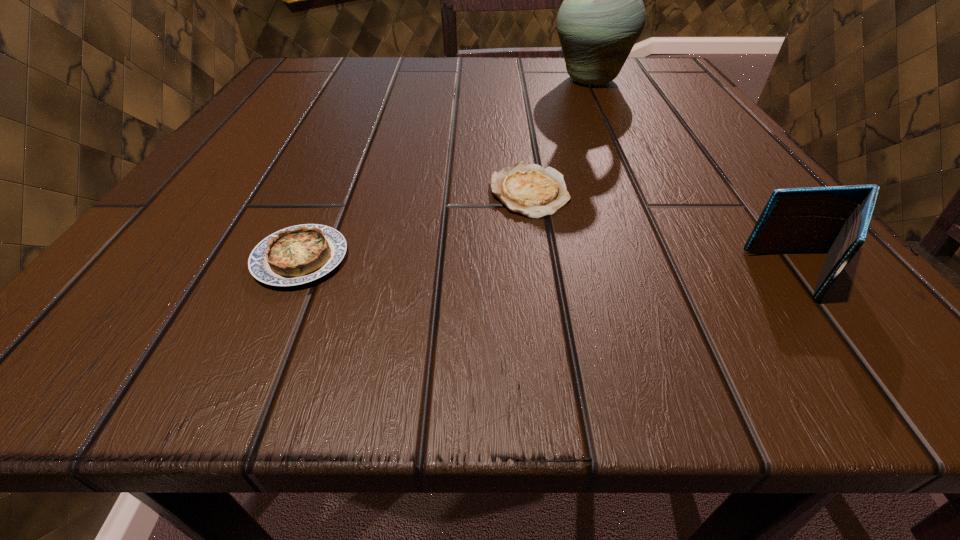
Choose which object is the third nearest neighbor to the farther quiche. Please provide its 2D coordinates. Your answer should be formatted as a tuple, i.e. [(x, y)], where the tuple contains the x and y coordinates of a point satisfying the conditions above.

[(602, 16)]

You are a GUI agent. You are given a task and a screenshot of the screen. Output one action in this format:
    pyautogui.click(x=<x>, y=<y>)
    Task: Click on the object that is the closest to the farthest object
    Image resolution: width=960 pixels, height=540 pixels.
    Given the screenshot: What is the action you would take?
    pyautogui.click(x=528, y=189)

The width and height of the screenshot is (960, 540). Find the location of `free spot that satisfies the following two spatial constraints: 1. on the handle side of the third object from left to right; 2. on the front side of the nearer quiche`. free spot that satisfies the following two spatial constraints: 1. on the handle side of the third object from left to right; 2. on the front side of the nearer quiche is located at coordinates (676, 259).